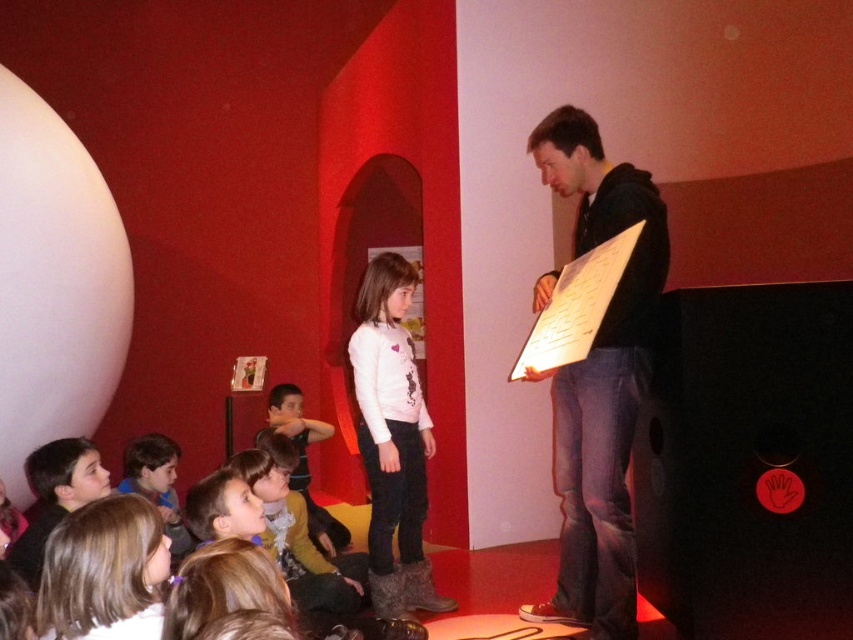
Who is lower down, black matte speaker at center or smooth blue shirt at lower left?

smooth blue shirt at lower left is below.

Is black matte speaker at center bigger than smooth blue shirt at lower left?

Yes.

The image size is (853, 640). I want to click on black matte speaker at center, so click(x=747, y=464).

Who is more forward, [78,614] or [189,534]?

Point [78,614]

Who is more forward, (97, 540) or (165, 468)?

A: Positioned in front is point (97, 540).

I want to click on smooth white shirt at lower left, so click(x=103, y=572).

Does black matte speaker at center have a lesser height compared to matte brown jacket at center?

In fact, black matte speaker at center may be taller than matte brown jacket at center.

Consider the image. Is black matte speaker at center positioned behind matte brown jacket at center?

No, it is in front of matte brown jacket at center.

This screenshot has height=640, width=853. I want to click on black matte speaker at center, so click(747, 464).